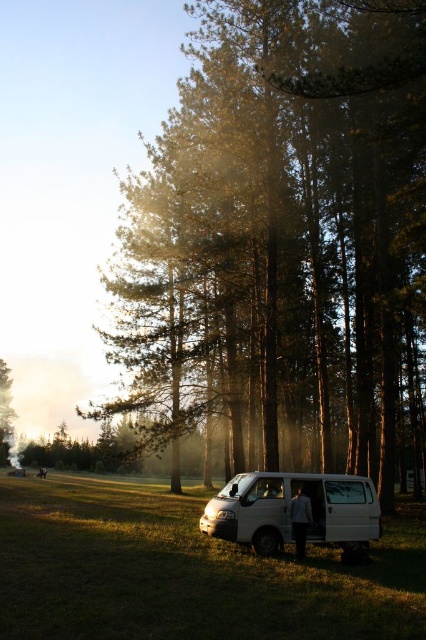
You are standing at point [325,477] and want to walk to the white van parked on the grassy area. Is the point [293,246] between you and the van?

Point [293,246] is behind point [325,477], so the point [293,246] is not between you and the van. You can walk directly to the van without encountering the point [293,246] first.

You are planning to take a photo of the white matte van at center from a distance. Considering the green textured pine trees at center, will the van be fully visible in the photo?

The green textured pine trees at center is bigger than white matte van at center, so the van may be partially obscured by the trees, making it not fully visible.